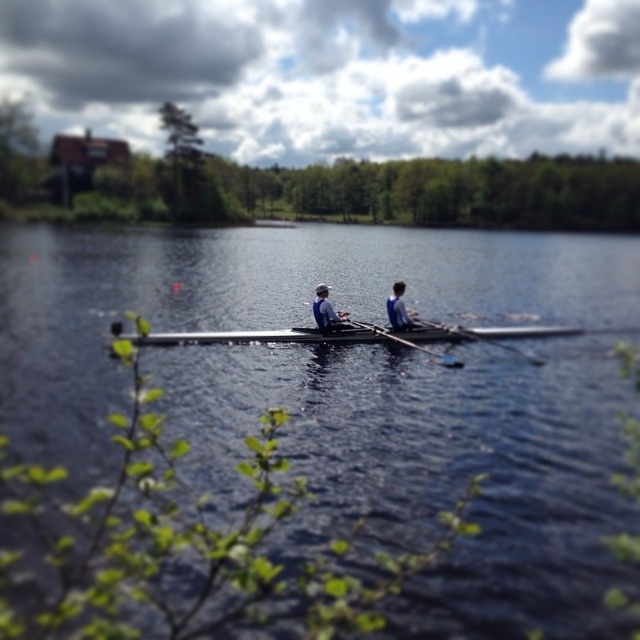
Question: Which point is farther to the camera?

Choices:
 (A) smooth wooden paddle at center
 (B) wooden oar at center

Answer: (A)

Question: Which point appears closest to the camera in this image?

Choices:
 (A) [339, 316]
 (B) [381, 332]
 (C) [401, 285]

Answer: (C)

Question: Can you confirm if dark blue water at center is smaller than smooth wooden paddle at center?

Choices:
 (A) yes
 (B) no

Answer: (B)

Question: Considering the relative positions of dark blue water at center and smooth wooden paddle at center in the image provided, where is dark blue water at center located with respect to smooth wooden paddle at center?

Choices:
 (A) below
 (B) above

Answer: (B)

Question: Which point is farther to the camera?

Choices:
 (A) (400, 317)
 (B) (93, 240)
 (C) (483, 340)
 (D) (333, 314)

Answer: (B)

Question: Can you confirm if smooth wooden paddle at center is positioned to the right of blue fabric shirt at center?

Choices:
 (A) yes
 (B) no

Answer: (A)